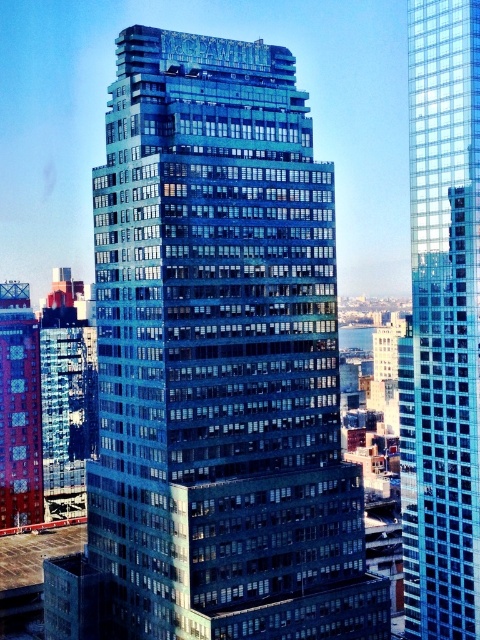
Question: Which point appears farthest from the camera in this image?

Choices:
 (A) (172, 100)
 (B) (458, 336)

Answer: (B)

Question: Can you confirm if shiny blue glass building at left is positioned to the left of metallic red building at left?

Choices:
 (A) yes
 (B) no

Answer: (A)

Question: Is shiny glass building at center closer to the viewer compared to glassy reflective skyscraper at center?

Choices:
 (A) no
 (B) yes

Answer: (B)

Question: Which of the following is the farthest from the observer?

Choices:
 (A) shiny glass building at center
 (B) metallic red building at left
 (C) shiny blue glass building at left

Answer: (C)

Question: Is shiny glass building at center smaller than glassy reflective skyscraper at center?

Choices:
 (A) yes
 (B) no

Answer: (B)

Question: Among these objects, which one is farthest from the camera?

Choices:
 (A) shiny glass building at center
 (B) glassy reflective skyscraper at center

Answer: (B)